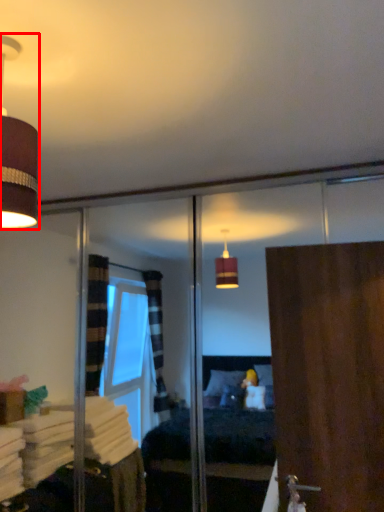
Question: Where is lamp (annotated by the red box) located in relation to door in the image?

Choices:
 (A) left
 (B) right

Answer: (A)